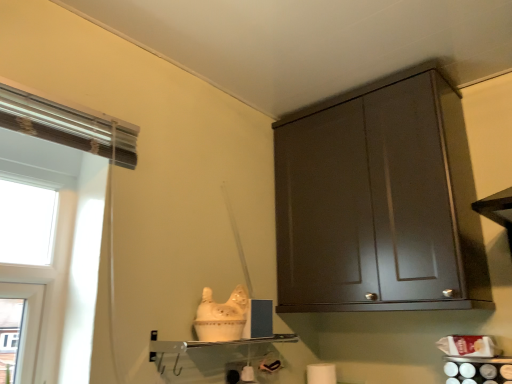
Question: Is white matte toilet paper at lower center bigger than dark wood cabinet at upper right?

Choices:
 (A) no
 (B) yes

Answer: (A)

Question: Considering the relative sizes of white matte toilet paper at lower center and dark wood cabinet at upper right in the image provided, is white matte toilet paper at lower center taller than dark wood cabinet at upper right?

Choices:
 (A) yes
 (B) no

Answer: (B)

Question: Is the depth of white matte toilet paper at lower center greater than that of dark wood cabinet at upper right?

Choices:
 (A) yes
 (B) no

Answer: (A)

Question: From the image's perspective, is white matte toilet paper at lower center over dark wood cabinet at upper right?

Choices:
 (A) no
 (B) yes

Answer: (A)

Question: Is white matte toilet paper at lower center far from dark wood cabinet at upper right?

Choices:
 (A) yes
 (B) no

Answer: (B)

Question: Is clear glass shelf at center situated inside white matte toilet paper at lower center or outside?

Choices:
 (A) inside
 (B) outside

Answer: (B)

Question: Considering the relative positions of clear glass shelf at center and white matte toilet paper at lower center in the image provided, is clear glass shelf at center to the left or to the right of white matte toilet paper at lower center?

Choices:
 (A) right
 (B) left

Answer: (B)

Question: From a real-world perspective, is clear glass shelf at center above or below white matte toilet paper at lower center?

Choices:
 (A) below
 (B) above

Answer: (B)

Question: In terms of height, does clear glass shelf at center look taller or shorter compared to white matte toilet paper at lower center?

Choices:
 (A) tall
 (B) short

Answer: (B)

Question: Choose the correct answer: Is white matte toilet paper at lower center inside dark wood cabinet at upper right or outside it?

Choices:
 (A) outside
 (B) inside

Answer: (A)

Question: From a real-world perspective, is white matte toilet paper at lower center positioned above or below dark wood cabinet at upper right?

Choices:
 (A) below
 (B) above

Answer: (A)

Question: From the image's perspective, is white matte toilet paper at lower center above or below dark wood cabinet at upper right?

Choices:
 (A) below
 (B) above

Answer: (A)

Question: Looking at their shapes, would you say white matte toilet paper at lower center is wider or thinner than dark wood cabinet at upper right?

Choices:
 (A) thin
 (B) wide

Answer: (A)

Question: Is dark wood cabinet at upper right spatially inside clear glass shelf at center, or outside of it?

Choices:
 (A) outside
 (B) inside

Answer: (A)

Question: From their relative heights in the image, would you say dark wood cabinet at upper right is taller or shorter than clear glass shelf at center?

Choices:
 (A) tall
 (B) short

Answer: (A)